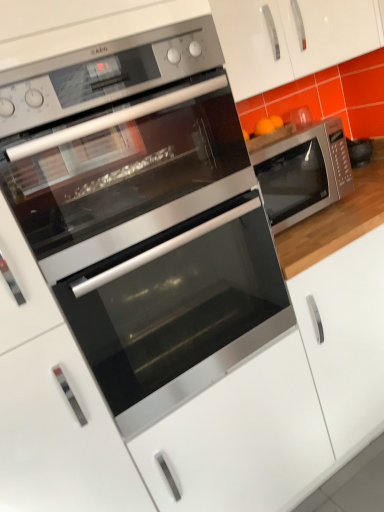
Question: Is the position of stainless steel microwave at right, which ranks as the 2th microwave oven in front-to-back order, more distant than that of satin silver oven at center?

Choices:
 (A) yes
 (B) no

Answer: (A)

Question: Considering the relative sizes of stainless steel microwave at right, marked as the 2th microwave oven in a left-to-right arrangement, and satin silver oven at center in the image provided, is stainless steel microwave at right, marked as the 2th microwave oven in a left-to-right arrangement, thinner than satin silver oven at center?

Choices:
 (A) yes
 (B) no

Answer: (A)

Question: Could satin silver oven at center be considered to be inside stainless steel microwave at right, the first microwave oven viewed from the back?

Choices:
 (A) no
 (B) yes

Answer: (A)

Question: Can you confirm if stainless steel microwave at right, which ranks as the 2th microwave oven in front-to-back order, is wider than satin silver oven at center?

Choices:
 (A) no
 (B) yes

Answer: (A)

Question: Are stainless steel microwave at right, the 1th microwave oven when ordered from right to left, and satin silver oven at center far apart?

Choices:
 (A) no
 (B) yes

Answer: (A)

Question: Considering the positions of stainless steel microwave at right, marked as the 2th microwave oven in a left-to-right arrangement, and satin silver oven at center in the image, is stainless steel microwave at right, marked as the 2th microwave oven in a left-to-right arrangement, taller or shorter than satin silver oven at center?

Choices:
 (A) tall
 (B) short

Answer: (B)

Question: From a real-world perspective, is stainless steel microwave at right, the first microwave oven viewed from the back, positioned above or below satin silver oven at center?

Choices:
 (A) below
 (B) above

Answer: (B)

Question: In the image, is stainless steel microwave at right, which ranks as the 2th microwave oven in front-to-back order, on the left side or the right side of satin silver oven at center?

Choices:
 (A) left
 (B) right

Answer: (B)

Question: Choose the correct answer: Is stainless steel microwave at right, the first microwave oven viewed from the back, inside satin silver oven at center or outside it?

Choices:
 (A) outside
 (B) inside

Answer: (A)

Question: Considering the positions of satin white drawer at center, which is the 1th drawer in right-to-left order, and satin silver drawer at center, which is the 2th drawer in right-to-left order, in the image, is satin white drawer at center, which is the 1th drawer in right-to-left order, bigger or smaller than satin silver drawer at center, which is the 2th drawer in right-to-left order,?

Choices:
 (A) big
 (B) small

Answer: (B)

Question: Do you think satin white drawer at center, which is the 1th drawer in right-to-left order, is within satin silver drawer at center, which is the 2th drawer in right-to-left order, or outside of it?

Choices:
 (A) inside
 (B) outside

Answer: (B)

Question: In the image, is satin white drawer at center, which is counted as the 2th drawer, starting from the left, positioned in front of or behind satin silver drawer at center, which is the 2th drawer in right-to-left order?

Choices:
 (A) front
 (B) behind

Answer: (B)

Question: Is point (284, 373) closer or farther from the camera than point (18, 395)?

Choices:
 (A) farther
 (B) closer

Answer: (A)

Question: Looking at the image, does stainless steel microwave at right, the second microwave oven when ordered from back to front, seem bigger or smaller compared to satin white drawer at center, which is the 1th drawer in right-to-left order?

Choices:
 (A) small
 (B) big

Answer: (A)

Question: Is stainless steel microwave at right, placed as the 1th microwave oven when sorted from front to back, in front of or behind satin white drawer at center, which is the 1th drawer in right-to-left order, in the image?

Choices:
 (A) behind
 (B) front

Answer: (B)